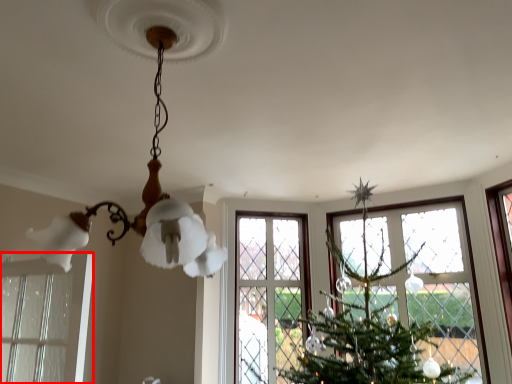
Question: From the image's perspective, what is the correct spatial positioning of window (annotated by the red box) in reference to lamp?

Choices:
 (A) below
 (B) above

Answer: (A)